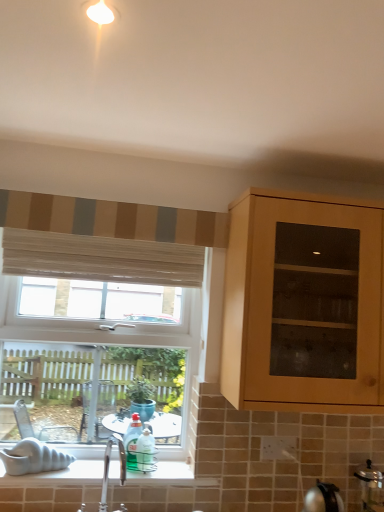
Image resolution: width=384 pixels, height=512 pixels. I want to click on free space above striped fabric at upper left, arranged as the 2th curtain when ordered from the bottom (from a real-world perspective), so click(x=107, y=199).